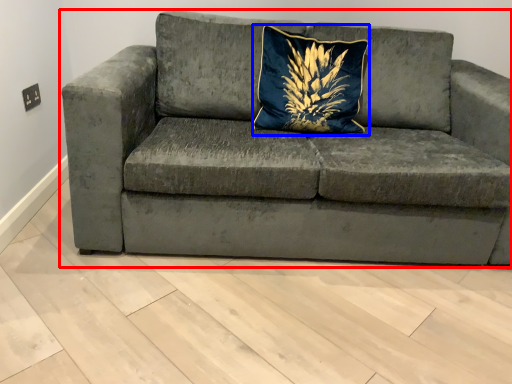
Question: Which object appears farthest to the camera in this image, studio couch (highlighted by a red box) or pillow (highlighted by a blue box)?

Choices:
 (A) studio couch
 (B) pillow

Answer: (B)